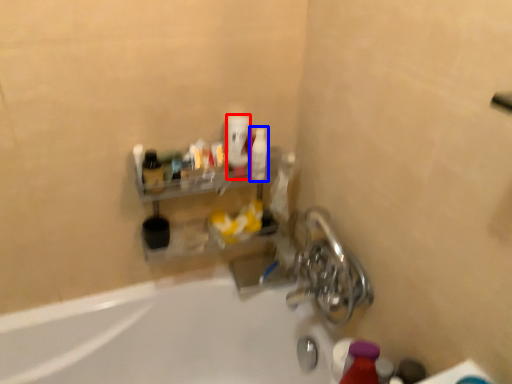
Question: Which point is further to the camera, mouthwash (highlighted by a red box) or mouthwash (highlighted by a blue box)?

Choices:
 (A) mouthwash
 (B) mouthwash

Answer: (B)